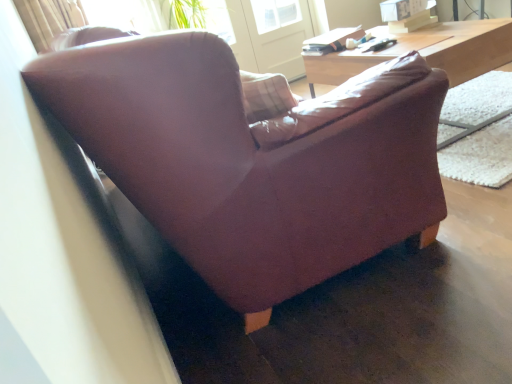
Question: From a real-world perspective, is leather couch at center below transparent glass screen door at upper center?

Choices:
 (A) no
 (B) yes

Answer: (B)

Question: Is leather couch at center further to the viewer compared to transparent glass screen door at upper center?

Choices:
 (A) no
 (B) yes

Answer: (A)

Question: Is transparent glass screen door at upper center surrounded by leather couch at center?

Choices:
 (A) yes
 (B) no

Answer: (B)

Question: Is leather couch at center taller than transparent glass screen door at upper center?

Choices:
 (A) no
 (B) yes

Answer: (A)

Question: Can you confirm if leather couch at center is positioned to the right of transparent glass screen door at upper center?

Choices:
 (A) yes
 (B) no

Answer: (A)

Question: Considering the relative sizes of leather couch at center and transparent glass screen door at upper center in the image provided, is leather couch at center wider than transparent glass screen door at upper center?

Choices:
 (A) no
 (B) yes

Answer: (B)

Question: Is wooden desk at upper right to the left of leather couch at center from the viewer's perspective?

Choices:
 (A) yes
 (B) no

Answer: (B)

Question: From a real-world perspective, is wooden desk at upper right positioned under leather couch at center based on gravity?

Choices:
 (A) yes
 (B) no

Answer: (B)

Question: Could you tell me if wooden desk at upper right is facing leather couch at center?

Choices:
 (A) yes
 (B) no

Answer: (B)

Question: Considering the relative sizes of wooden desk at upper right and leather couch at center in the image provided, is wooden desk at upper right wider than leather couch at center?

Choices:
 (A) no
 (B) yes

Answer: (A)

Question: From the image's perspective, does wooden desk at upper right appear lower than leather couch at center?

Choices:
 (A) yes
 (B) no

Answer: (B)

Question: Is the position of wooden desk at upper right less distant than that of leather couch at center?

Choices:
 (A) yes
 (B) no

Answer: (B)

Question: Is wooden desk at upper right outside transparent glass screen door at upper center?

Choices:
 (A) no
 (B) yes

Answer: (B)